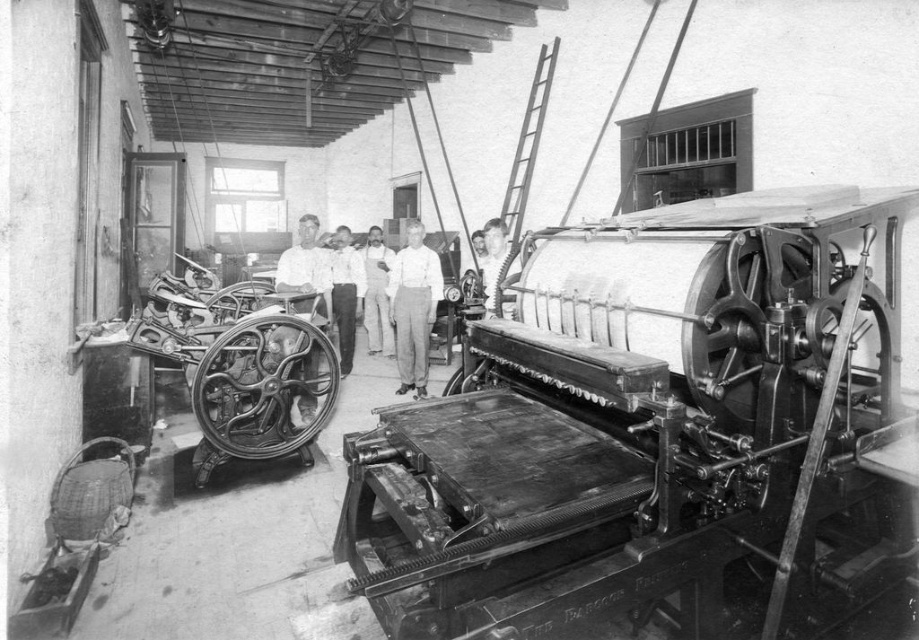
Question: Which of these objects is positioned closest to the light gray cotton pants at center?

Choices:
 (A) light gray cotton shirt at center
 (B) metallic/smooth printing press at center-right
 (C) smooth white shirt at center

Answer: (C)

Question: Which object is positioned farthest from the metallic/smooth printing press at center-right?

Choices:
 (A) smooth white shirt at center
 (B) light gray cotton pants at center
 (C) light gray cotton shirt at center

Answer: (C)

Question: Does light gray cotton shirt at center come behind white cotton overalls at center?

Choices:
 (A) no
 (B) yes

Answer: (A)

Question: Does white cotton overalls at center come behind smooth white shirt at center?

Choices:
 (A) no
 (B) yes

Answer: (B)

Question: Which point is closer to the camera taking this photo?

Choices:
 (A) (350, 323)
 (B) (384, 296)
 (C) (486, 227)
 (D) (434, 310)

Answer: (C)

Question: Can you confirm if light gray cotton shirt at center is bigger than white cotton overalls at center?

Choices:
 (A) no
 (B) yes

Answer: (B)